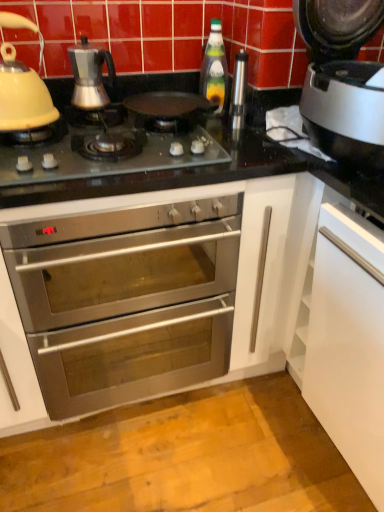
Question: Does white glossy dishwasher at lower right, the second appliance viewed from the top, have a greater height compared to green glass bottle at center?

Choices:
 (A) no
 (B) yes

Answer: (B)

Question: From a real-world perspective, is white glossy dishwasher at lower right, the 1th appliance in the bottom-to-top sequence, over green glass bottle at center?

Choices:
 (A) yes
 (B) no

Answer: (B)

Question: Is the depth of white glossy dishwasher at lower right, the 2th appliance in the left-to-right sequence, less than that of green glass bottle at center?

Choices:
 (A) yes
 (B) no

Answer: (A)

Question: Can you confirm if white glossy dishwasher at lower right, the 2th appliance in the left-to-right sequence, is smaller than green glass bottle at center?

Choices:
 (A) no
 (B) yes

Answer: (A)

Question: Is white glossy dishwasher at lower right, marked as the 1th appliance in a right-to-left arrangement, facing away from green glass bottle at center?

Choices:
 (A) yes
 (B) no

Answer: (B)

Question: In terms of width, does matte yellow kettle at left, placed as the second kitchen appliance when sorted from right to left, look wider or thinner when compared to stainless steel oven at center?

Choices:
 (A) thin
 (B) wide

Answer: (A)

Question: Considering their positions, is matte yellow kettle at left, the first kitchen appliance when ordered from left to right, located in front of or behind stainless steel oven at center?

Choices:
 (A) behind
 (B) front

Answer: (A)

Question: Considering the positions of point (x=54, y=118) and point (x=96, y=329), is point (x=54, y=118) closer or farther from the camera than point (x=96, y=329)?

Choices:
 (A) farther
 (B) closer

Answer: (B)

Question: Based on their positions, is matte yellow kettle at left, placed as the second kitchen appliance when sorted from right to left, located to the left or right of stainless steel oven at center?

Choices:
 (A) left
 (B) right

Answer: (A)

Question: Considering the positions of point (23, 94) and point (140, 159), is point (23, 94) closer or farther from the camera than point (140, 159)?

Choices:
 (A) closer
 (B) farther

Answer: (B)

Question: From their relative heights in the image, would you say matte yellow kettle at left, placed as the second kitchen appliance when sorted from right to left, is taller or shorter than black glass gas stove at center?

Choices:
 (A) short
 (B) tall

Answer: (B)

Question: Is matte yellow kettle at left, the first kitchen appliance when ordered from left to right, in front of or behind black glass gas stove at center in the image?

Choices:
 (A) behind
 (B) front

Answer: (A)

Question: From the image's perspective, is matte yellow kettle at left, placed as the second kitchen appliance when sorted from right to left, located above or below black glass gas stove at center?

Choices:
 (A) above
 (B) below

Answer: (A)

Question: Based on their sizes in the image, would you say white glossy dishwasher at lower right, the second appliance viewed from the top, is bigger or smaller than green glass bottle at center?

Choices:
 (A) big
 (B) small

Answer: (A)

Question: From a real-world perspective, is white glossy dishwasher at lower right, the second appliance viewed from the top, above or below green glass bottle at center?

Choices:
 (A) below
 (B) above

Answer: (A)